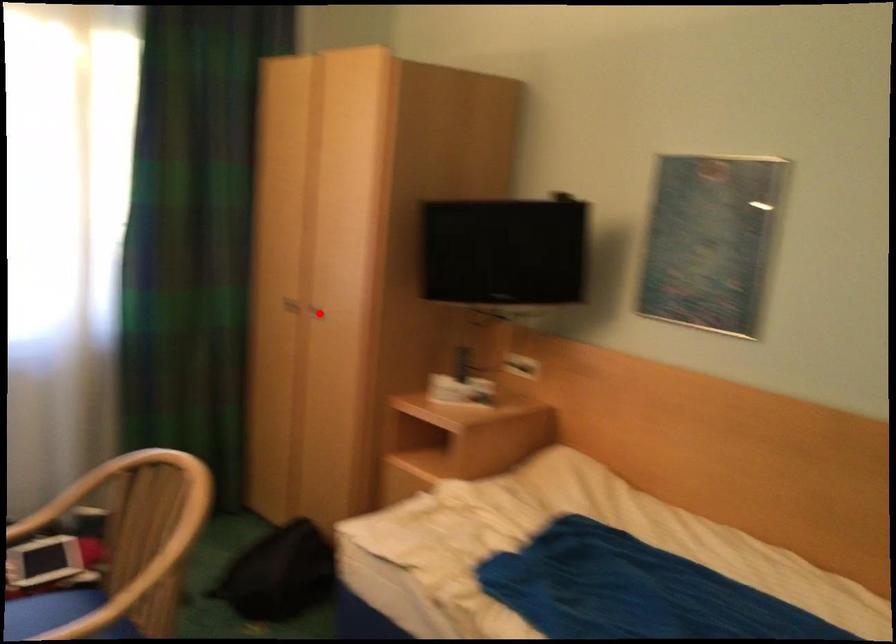
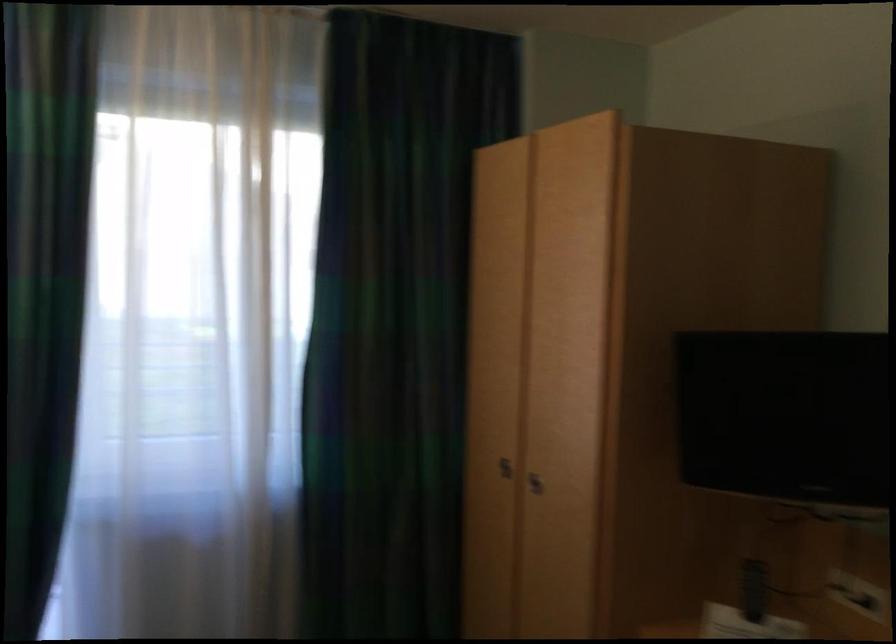
The point at the highlighted location is marked in the first image. Where is the corresponding point in the second image?

(535, 483)